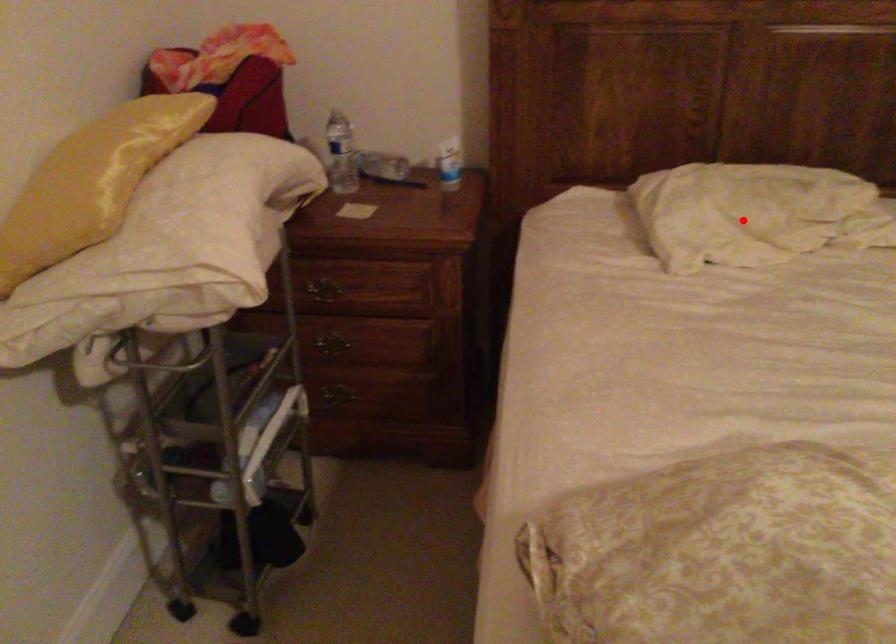
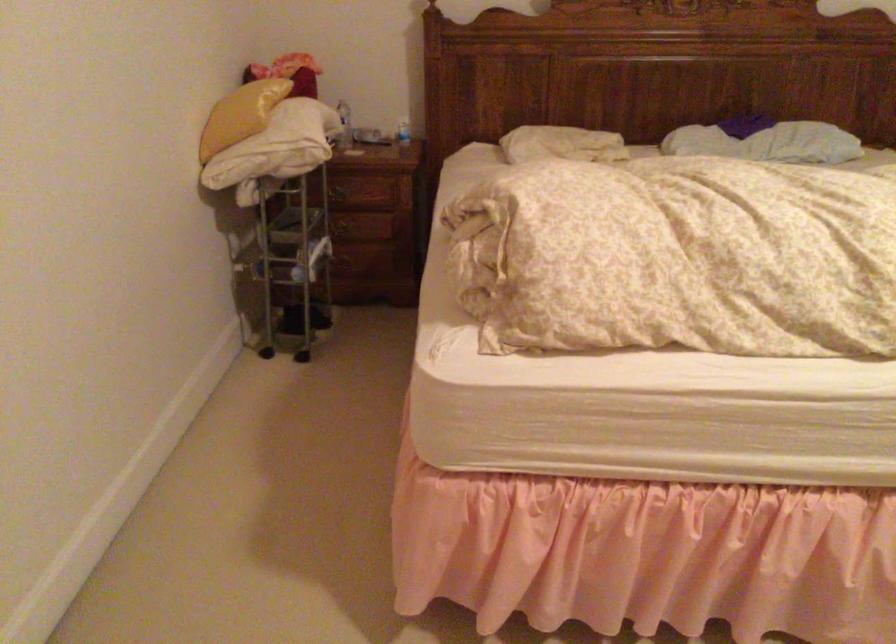
Question: I am providing you with two images of the same scene from different viewpoints. A red point is shown in image1. For the corresponding object point in image2, is it positioned nearer or farther from the camera?

Choices:
 (A) Nearer
 (B) Farther

Answer: (B)